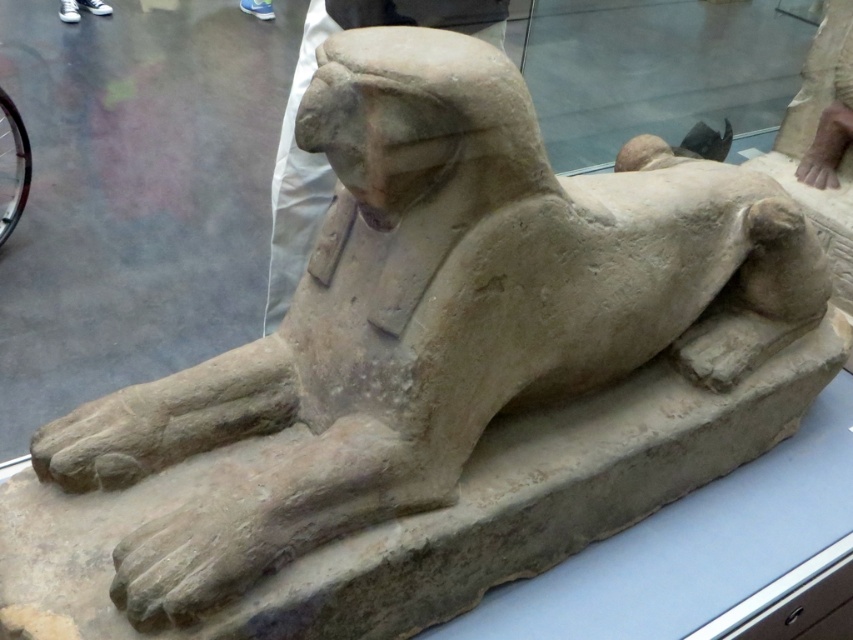
Is stone statue at center taller than white canvas shoes at upper left?

Indeed, stone statue at center has a greater height compared to white canvas shoes at upper left.

Can you confirm if stone statue at center is smaller than white canvas shoes at upper left?

No, stone statue at center is not smaller than white canvas shoes at upper left.

The height and width of the screenshot is (640, 853). What do you see at coordinates (322, 154) in the screenshot?
I see `stone statue at center` at bounding box center [322, 154].

Where is `stone statue at center`? stone statue at center is located at coordinates (322, 154).